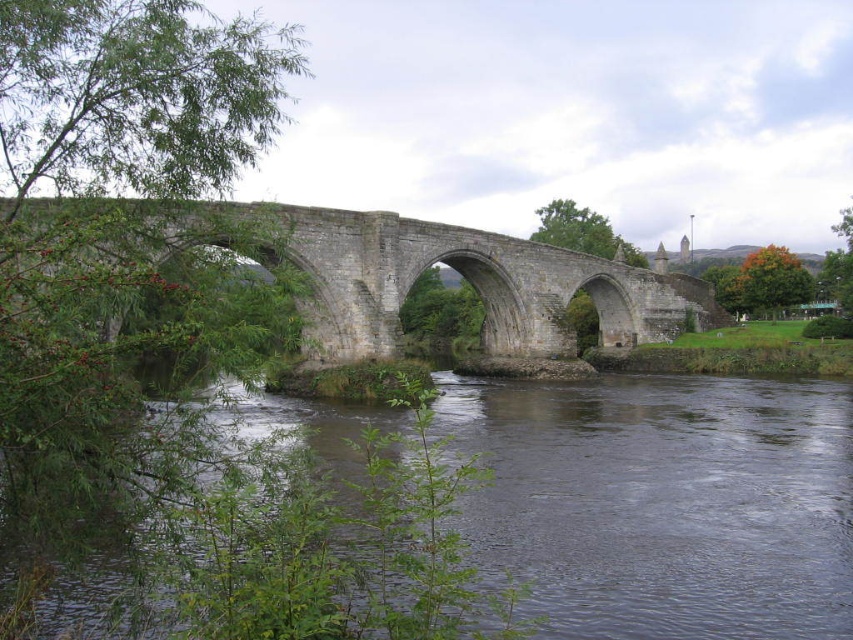
Is dark gray water at center to the right of stone bridge at center from the viewer's perspective?

Yes, dark gray water at center is to the right of stone bridge at center.

Where is `dark gray water at center`? dark gray water at center is located at coordinates (666, 502).